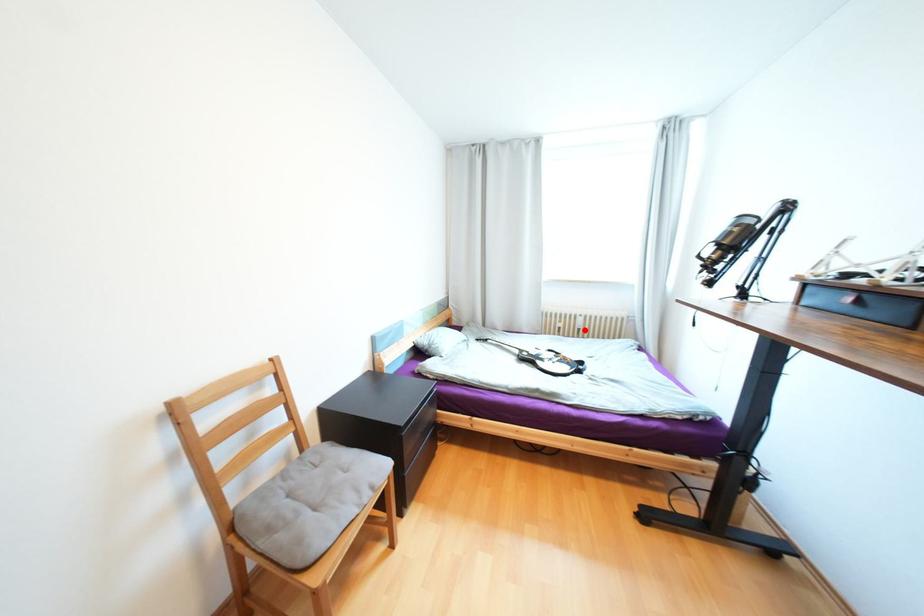
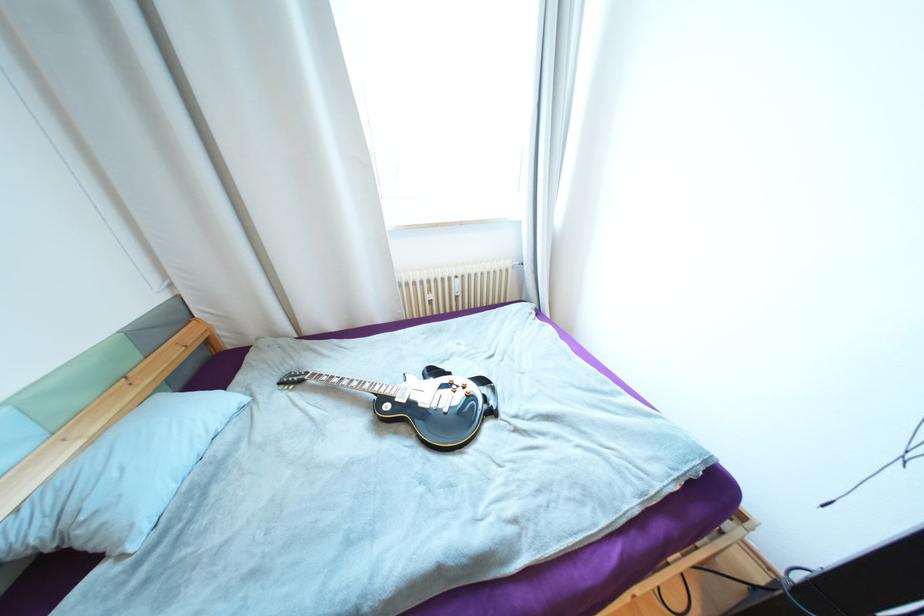
The point at the highlighted location is marked in the first image. Where is the corresponding point in the second image?

(463, 297)